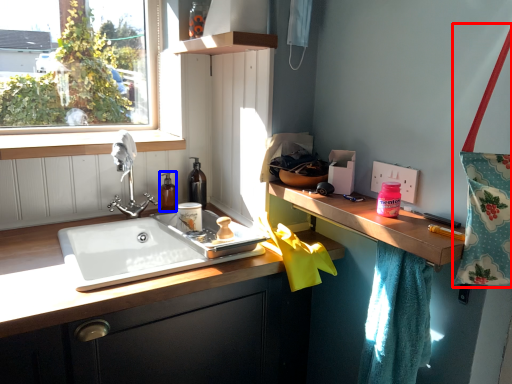
Question: Which of the following is the farthest to the observer, tote bag (highlighted by a red box) or toiletry (highlighted by a blue box)?

Choices:
 (A) tote bag
 (B) toiletry

Answer: (B)